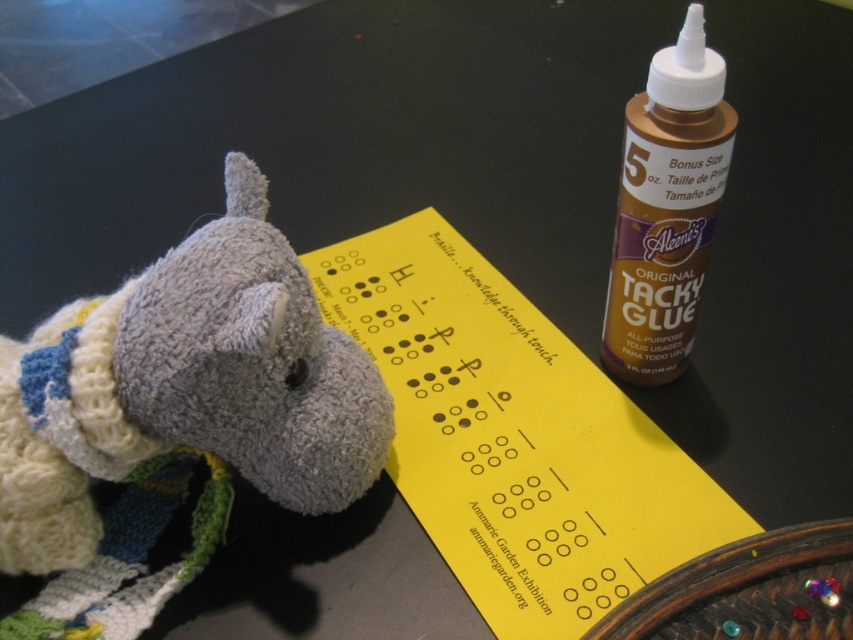
The height and width of the screenshot is (640, 853). What are the coordinates of `knitted gray horse at lower left` in the screenshot? It's located at (181, 401).

Between knitted gray horse at lower left and brown matte glue at upper right, which one is positioned higher?

brown matte glue at upper right is higher up.

Which is in front, point (376, 433) or point (639, 381)?

Point (376, 433) is more forward.

This screenshot has height=640, width=853. In order to click on knitted gray horse at lower left in this screenshot , I will do `click(181, 401)`.